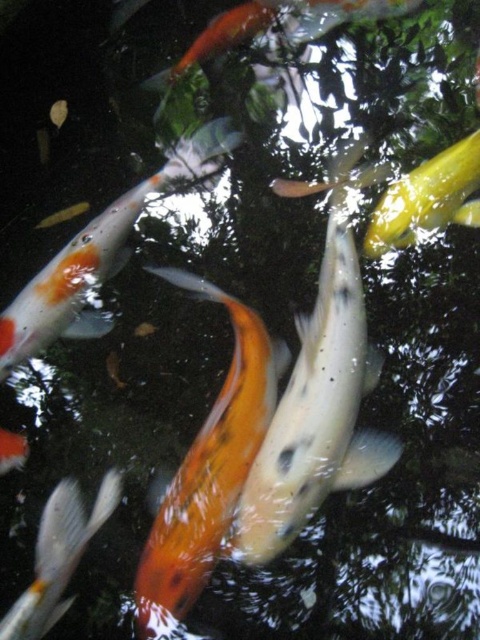
What do you see at coordinates (316, 404) in the screenshot? Image resolution: width=480 pixels, height=640 pixels. I see `speckled white fish at center` at bounding box center [316, 404].

Does speckled white fish at center have a greater height compared to shiny gold fish at upper right?

Correct, speckled white fish at center is much taller as shiny gold fish at upper right.

Is point (362, 442) more distant than point (456, 154)?

No, (362, 442) is in front of (456, 154).

At what (x,y) coordinates should I click in order to perform the action: click on speckled white fish at center. Please return your answer as a coordinate pair (x, y). The width and height of the screenshot is (480, 640). Looking at the image, I should click on (316, 404).

Can you confirm if orange and white speckled fish at center is wider than orange and white speckled fish at lower left?

Indeed, orange and white speckled fish at center has a greater width compared to orange and white speckled fish at lower left.

Is orange and white speckled fish at center further to the viewer compared to orange and white speckled fish at lower left?

That is True.

Who is more distant from viewer, (96,276) or (67,484)?

Positioned behind is point (96,276).

Identify the location of orange and white speckled fish at center. This screenshot has width=480, height=640. click(99, 253).

Is speckled white fish at center thinner than orange and white speckled fish at center?

Correct, speckled white fish at center's width is less than orange and white speckled fish at center's.

How far apart are speckled white fish at center and orange and white speckled fish at center?

They are 21.32 inches apart.

Is point (228, 540) in front of point (202, 145)?

That is True.

Where is `speckled white fish at center`? This screenshot has height=640, width=480. speckled white fish at center is located at coordinates (316, 404).